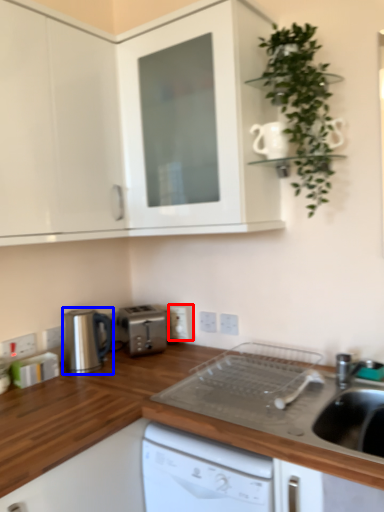
Question: Among these objects, which one is nearest to the camera, electric outlet (highlighted by a red box) or home appliance (highlighted by a blue box)?

Choices:
 (A) electric outlet
 (B) home appliance

Answer: (B)